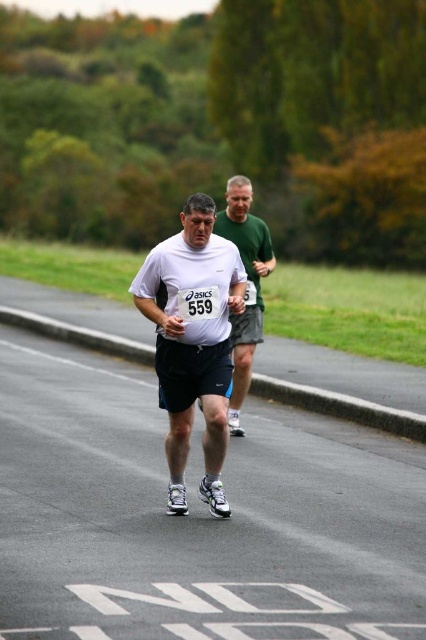
You are a photographer standing at point A, which is 7.80 meters away from the point marked as point (152, 310). You want to take a photo of the two runners in the scene. Can you estimate whether the camera at point A can capture both runners in the frame?

The point marked as (152, 310) is 7.80 meters away from the camera at point A. Since the camera is positioned to capture the foreground runner clearly and the background runner is within the same general area, it is likely that both runners can be captured in the frame from this distance.

You are a photographer trying to capture a closeup of the white matte shirt at center and white matte shorts at center. Which item will appear wider in the photo?

The white matte shorts at center will appear wider in the photo because its width surpasses that of the white matte shirt at center.

Please provide the 2D coordinates of the white matte shorts at center in the image. The coordinates should be in the format of a point with two decimal places, such as point 0.5,0.5.

The white matte shorts at center is located at point (192, 340).